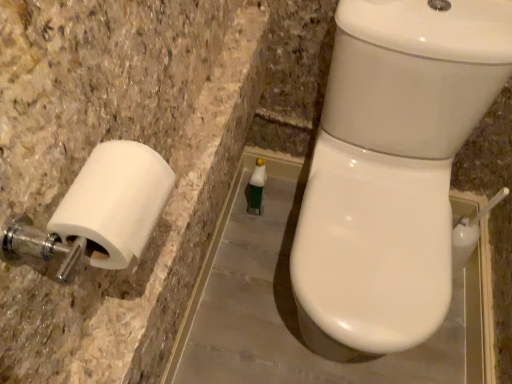
At what (x,y) coordinates should I click in order to perform the action: click on white glossy toilet at right. Please return your answer as a coordinate pair (x, y). Image resolution: width=512 pixels, height=384 pixels. Looking at the image, I should click on (391, 169).

Locate an element on the screen. This screenshot has width=512, height=384. white matte toilet paper at left is located at coordinates (115, 202).

Measure the distance between green matte bottle at center and camera.

green matte bottle at center and camera are 4.98 feet apart from each other.

This screenshot has height=384, width=512. I want to click on white glossy toilet at right, so click(391, 169).

Which is correct: white glossy toilet at right is inside white matte toilet paper at left, or outside of it?

white glossy toilet at right cannot be found inside white matte toilet paper at left.

Is white glossy toilet at right oriented away from white matte toilet paper at left?

No.

Can you confirm if white glossy toilet at right is taller than white matte toilet paper at left?

Correct, white glossy toilet at right is much taller as white matte toilet paper at left.

From a real-world perspective, which is physically above, white glossy toilet at right or white matte toilet paper at left?

white matte toilet paper at left.

Considering the relative sizes of green matte bottle at center and white glossy toilet at right in the image provided, is green matte bottle at center thinner than white glossy toilet at right?

Correct, the width of green matte bottle at center is less than that of white glossy toilet at right.

Is green matte bottle at center aimed at white glossy toilet at right?

No, green matte bottle at center does not turn towards white glossy toilet at right.

Image resolution: width=512 pixels, height=384 pixels. In order to click on toilet to the right of green matte bottle at center in this screenshot , I will do `click(391, 169)`.

How many degrees apart are the facing directions of green matte bottle at center and white glossy toilet at right?

They differ by 2.39 degrees in their facing directions.

Could you tell me if green matte bottle at center is facing white matte toilet paper at left?

No, green matte bottle at center does not turn towards white matte toilet paper at left.

From their relative heights in the image, would you say green matte bottle at center is taller or shorter than white matte toilet paper at left?

Clearly, green matte bottle at center is taller compared to white matte toilet paper at left.

Which is more to the right, green matte bottle at center or white matte toilet paper at left?

green matte bottle at center.

Can we say green matte bottle at center lies outside white matte toilet paper at left?

Yes.

Is white matte toilet paper at left with white glossy toilet at right?

No, white matte toilet paper at left is not next to white glossy toilet at right.

Is white glossy toilet at right at the back of white matte toilet paper at left?

white matte toilet paper at left is not turned away from white glossy toilet at right.

From the image's perspective, is white matte toilet paper at left below white glossy toilet at right?

Yes, from the image's perspective, white matte toilet paper at left is below white glossy toilet at right.

Who is more distant, white matte toilet paper at left or white glossy toilet at right?

white glossy toilet at right is further away from the camera.

Is white glossy toilet at right at the left side of green matte bottle at center?

Incorrect, white glossy toilet at right is not on the left side of green matte bottle at center.

From the image's perspective, which object appears higher, white glossy toilet at right or green matte bottle at center?

green matte bottle at center, from the image's perspective.

From a real-world perspective, who is located lower, white glossy toilet at right or green matte bottle at center?

green matte bottle at center.

From the image's perspective, is white matte toilet paper at left under green matte bottle at center?

Yes, from the image's perspective, white matte toilet paper at left is beneath green matte bottle at center.

Is white matte toilet paper at left turned away from green matte bottle at center?

No, white matte toilet paper at left is not facing away from green matte bottle at center.

Is white matte toilet paper at left at the left side of green matte bottle at center?

Indeed, white matte toilet paper at left is positioned on the left side of green matte bottle at center.

Locate an element on the screen. The height and width of the screenshot is (384, 512). toilet paper below the white glossy toilet at right (from the image's perspective) is located at coordinates (115, 202).

Where is `toiletry behind the white glossy toilet at right`? toiletry behind the white glossy toilet at right is located at coordinates (256, 188).

From the image, which object appears to be nearer to white glossy toilet at right, white matte toilet paper at left or green matte bottle at center?

Among the two, green matte bottle at center is located nearer to white glossy toilet at right.

Based on their spatial positions, is white matte toilet paper at left or white glossy toilet at right closer to green matte bottle at center?

white glossy toilet at right lies closer to green matte bottle at center than the other object.

Which object lies further to the anchor point white matte toilet paper at left, white glossy toilet at right or green matte bottle at center?

green matte bottle at center is positioned further to the anchor white matte toilet paper at left.

Estimate the real-world distances between objects in this image. Which object is further from green matte bottle at center, white glossy toilet at right or white matte toilet paper at left?

white matte toilet paper at left is positioned further to the anchor green matte bottle at center.

Which object lies nearer to the anchor point white matte toilet paper at left, green matte bottle at center or white glossy toilet at right?

Based on the image, white glossy toilet at right appears to be nearer to white matte toilet paper at left.

Considering their positions, is green matte bottle at center positioned closer to white glossy toilet at right than white matte toilet paper at left?

Based on the image, green matte bottle at center appears to be nearer to white glossy toilet at right.

I want to click on toilet between white matte toilet paper at left and green matte bottle at center from front to back, so click(x=391, y=169).